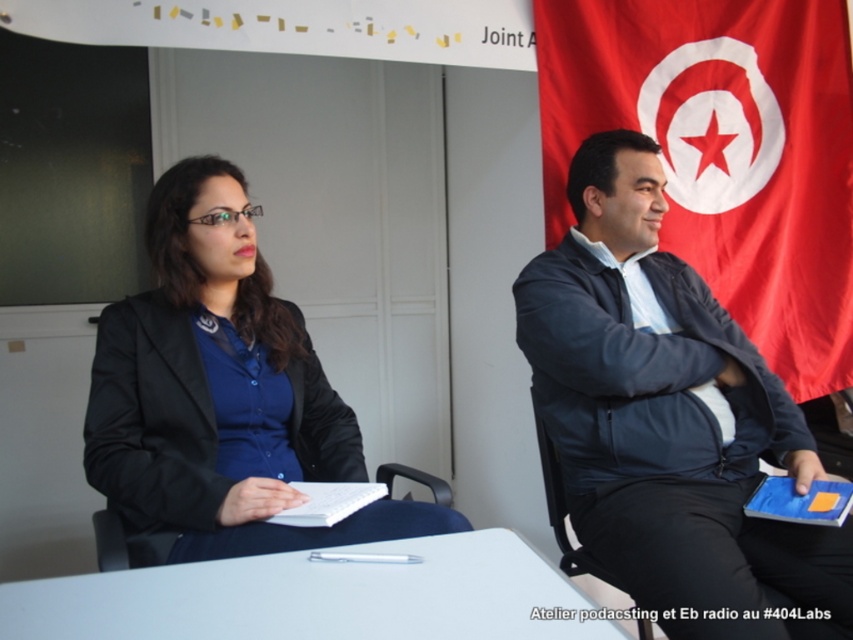
Question: Is matte black blazer at center closer to the viewer compared to white plastic table at center?

Choices:
 (A) no
 (B) yes

Answer: (A)

Question: Which point is farther to the camera?

Choices:
 (A) matte black blazer at center
 (B) red fabric flag at right

Answer: (B)

Question: Does red fabric flag at right have a larger size compared to white plastic table at center?

Choices:
 (A) no
 (B) yes

Answer: (B)

Question: Which object is farther from the camera taking this photo?

Choices:
 (A) red fabric flag at right
 (B) matte black blazer at center
 (C) white plastic table at center

Answer: (A)

Question: Which point is farther to the camera?

Choices:
 (A) (107, 332)
 (B) (601, 22)
 (C) (303, 582)

Answer: (B)

Question: Where is dark blue jacket at right located in relation to red fabric flag at right in the image?

Choices:
 (A) below
 (B) above

Answer: (A)